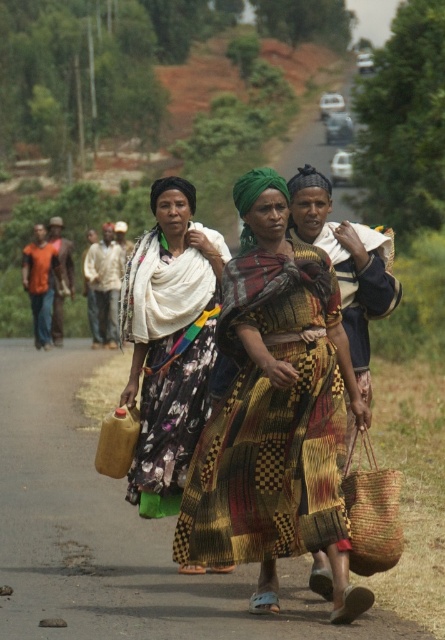
Question: Observing the image, what is the correct spatial positioning of multicolored woven dress at center in reference to floral fabric dress at center?

Choices:
 (A) below
 (B) above

Answer: (B)

Question: Which of these objects is positioned closest to the floral fabric dress at center?

Choices:
 (A) multicolored woven dress at center
 (B) braided straw basket at center

Answer: (A)

Question: Based on their relative distances, which object is nearer to the multicolored woven dress at center?

Choices:
 (A) braided straw basket at center
 (B) floral fabric dress at center

Answer: (A)

Question: In this image, where is multicolored woven dress at center located relative to floral fabric dress at center?

Choices:
 (A) below
 (B) above

Answer: (B)

Question: Is multicolored woven dress at center above floral fabric dress at center?

Choices:
 (A) yes
 (B) no

Answer: (A)

Question: Based on their relative distances, which object is nearer to the floral fabric dress at center?

Choices:
 (A) multicolored woven dress at center
 (B) braided straw basket at center

Answer: (A)